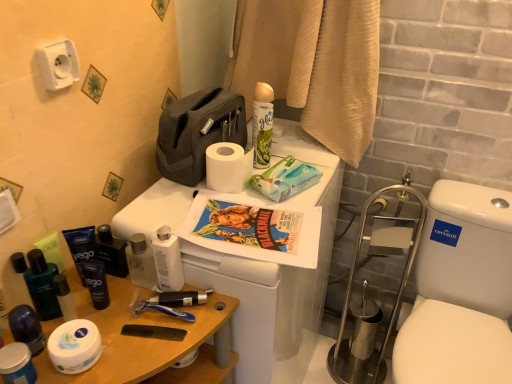
Locate an element on the screen. free location to the right of dark blue matte tube at left, marked as the 2th toiletry in a right-to-left arrangement is located at coordinates pos(159,316).